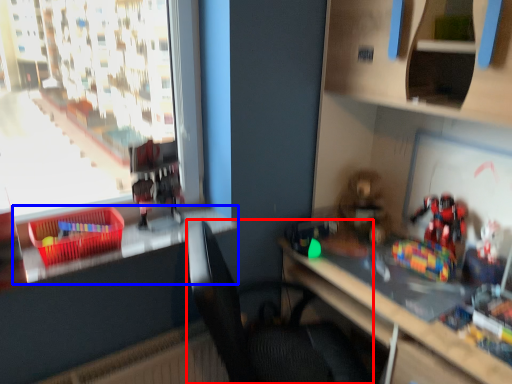
Question: Which of the following is the farthest to the observer, chair (highlighted by a red box) or window sill (highlighted by a blue box)?

Choices:
 (A) chair
 (B) window sill

Answer: (B)